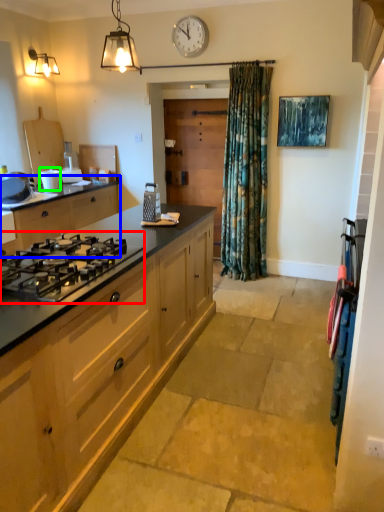
Question: Which object is positioned closest to gas stove (highlighted by a red box)? Select from cabinetry (highlighted by a blue box) and appliance (highlighted by a green box).

Choices:
 (A) cabinetry
 (B) appliance

Answer: (A)